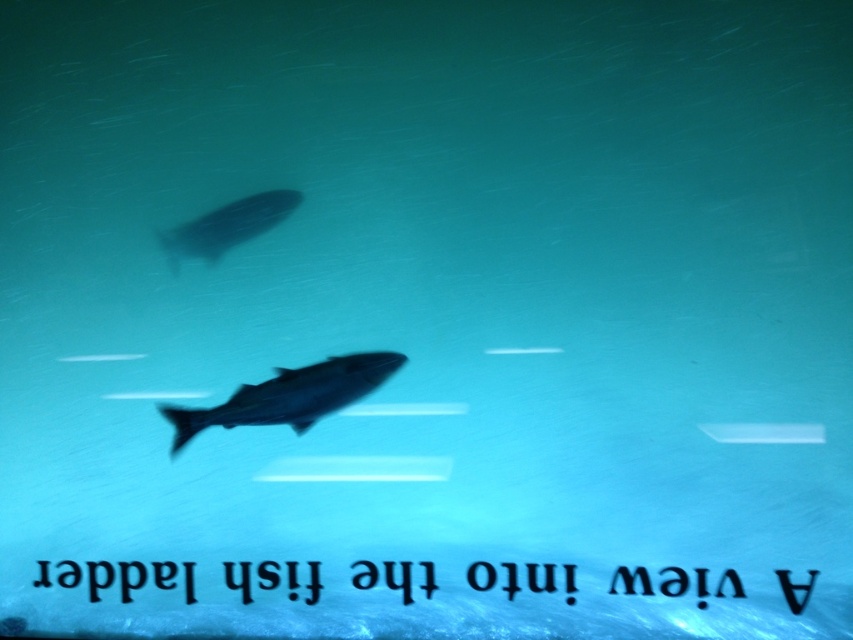
From the picture: You are an underwater photographer aiming to capture a clear image of both silvery metallic fish at center and silvery metallic fish at upper center. Which fish should you focus on first to ensure it appears sharp in your photo?

You should focus on the silvery metallic fish at center first because it is closer to the viewer, making it easier to achieve sharp focus before adjusting for the silvery metallic fish at upper center.

You are a marine biologist observing the fish ladder. You notice two silvery metallic fish. Which one is closer to you, the silvery metallic fish at center or the silvery metallic fish at upper center?

The silvery metallic fish at center is closer to you because it appears larger due to perspective, and the description states it is larger in size than the silvery metallic fish at upper center.